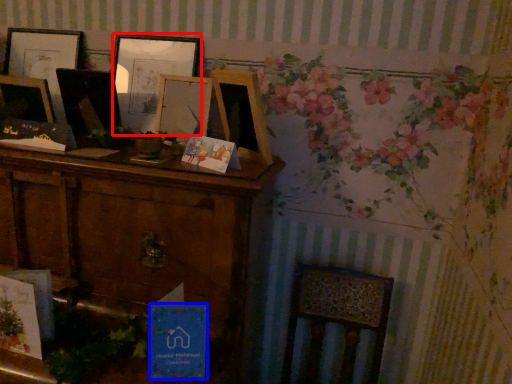
Question: Which point is further to the camera, picture frame (highlighted by a red box) or postcard (highlighted by a blue box)?

Choices:
 (A) picture frame
 (B) postcard

Answer: (A)